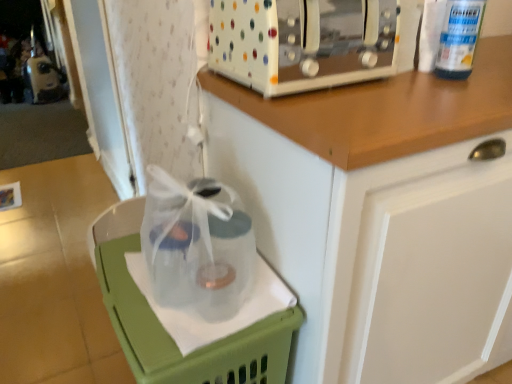
Locate an element on the screen. The width and height of the screenshot is (512, 384). white plastic bottle at upper right is located at coordinates (459, 38).

In order to face green plastic basket at lower left, should I rotate leftwards or rightwards?

A 8.299 degree turn to the left will do.

Identify the location of white plastic bottle at upper right. (459, 38).

Between white plastic bottle at upper right and green plastic basket at lower left, which one appears on the left side from the viewer's perspective?

green plastic basket at lower left.

Is white plastic bottle at upper right thinner than green plastic basket at lower left?

Correct, the width of white plastic bottle at upper right is less than that of green plastic basket at lower left.

What's the angular difference between white plastic bottle at upper right and green plastic basket at lower left's facing directions?

The angular difference between white plastic bottle at upper right and green plastic basket at lower left is 90.1 degrees.

Is white plastic bottle at upper right facing towards green plastic basket at lower left?

No, white plastic bottle at upper right is not oriented towards green plastic basket at lower left.

Is white plastic bottle at upper right outside of white polka dot toaster at upper center?

Yes, white plastic bottle at upper right is outside of white polka dot toaster at upper center.

Relative to white polka dot toaster at upper center, is white plastic bottle at upper right in front or behind?

Visually, white plastic bottle at upper right is located behind white polka dot toaster at upper center.

Considering the relative positions of white plastic bottle at upper right and white polka dot toaster at upper center in the image provided, is white plastic bottle at upper right to the left of white polka dot toaster at upper center from the viewer's perspective?

No, white plastic bottle at upper right is not to the left of white polka dot toaster at upper center.

Considering the sizes of objects green plastic basket at lower left and white plastic bottle at upper right in the image provided, who is shorter, green plastic basket at lower left or white plastic bottle at upper right?

With less height is white plastic bottle at upper right.

From a real-world perspective, is green plastic basket at lower left positioned under white plastic bottle at upper right based on gravity?

Yes, from a real-world perspective, green plastic basket at lower left is beneath white plastic bottle at upper right.

Is white polka dot toaster at upper center looking in the opposite direction of white glossy cabinet at upper center?

No, white polka dot toaster at upper center's orientation is not away from white glossy cabinet at upper center.

Between point (311, 23) and point (350, 311), which one is positioned in front?

Positioned in front is point (350, 311).

Which is behind, white polka dot toaster at upper center or white glossy cabinet at upper center?

white polka dot toaster at upper center is further away from the camera.

From the image's perspective, is white glossy cabinet at upper center positioned above or below white polka dot toaster at upper center?

Clearly, from the image's perspective, white glossy cabinet at upper center is below white polka dot toaster at upper center.

Does point (346, 173) come closer to viewer compared to point (286, 1)?

Yes.

Does white glossy cabinet at upper center have a greater width compared to white polka dot toaster at upper center?

Yes, white glossy cabinet at upper center is wider than white polka dot toaster at upper center.

Is white polka dot toaster at upper center taller than green plastic basket at lower left?

Incorrect, the height of white polka dot toaster at upper center is not larger of that of green plastic basket at lower left.

From a real-world perspective, who is located lower, white polka dot toaster at upper center or green plastic basket at lower left?

green plastic basket at lower left.

In the image, is white polka dot toaster at upper center on the left side or the right side of green plastic basket at lower left?

white polka dot toaster at upper center is to the right of green plastic basket at lower left.

In the image, is white polka dot toaster at upper center positioned in front of or behind green plastic basket at lower left?

In the image, white polka dot toaster at upper center appears behind green plastic basket at lower left.

Can you tell me how much white glossy cabinet at upper center and green plastic basket at lower left differ in facing direction?

The angle between the facing direction of white glossy cabinet at upper center and the facing direction of green plastic basket at lower left is 90.8 degrees.

Is white glossy cabinet at upper center next to green plastic basket at lower left and touching it?

No, white glossy cabinet at upper center is not making contact with green plastic basket at lower left.

Which is closer, [460,195] or [279,342]?

Point [460,195].

Is green plastic basket at lower left inside white glossy cabinet at upper center?

No, green plastic basket at lower left is located outside of white glossy cabinet at upper center.

Image resolution: width=512 pixels, height=384 pixels. In order to click on basket below the white plastic bottle at upper right (from a real-world perspective) in this screenshot , I will do `click(167, 332)`.

This screenshot has height=384, width=512. Find the location of `home appliance below the white plastic bottle at upper right (from the image's perspective)`. home appliance below the white plastic bottle at upper right (from the image's perspective) is located at coordinates (309, 42).

Based on their spatial positions, is white plastic bottle at upper right or white glossy cabinet at upper center closer to white polka dot toaster at upper center?

Based on the image, white plastic bottle at upper right appears to be nearer to white polka dot toaster at upper center.

Looking at this image, estimate the real-world distances between objects in this image. Which object is further from white plastic bottle at upper right, green plastic basket at lower left or white glossy cabinet at upper center?

green plastic basket at lower left is further to white plastic bottle at upper right.

Which object lies further to the anchor point white glossy cabinet at upper center, white polka dot toaster at upper center or white plastic bottle at upper right?

The object further to white glossy cabinet at upper center is white plastic bottle at upper right.

Based on their spatial positions, is white plastic bottle at upper right or green plastic basket at lower left closer to white polka dot toaster at upper center?

white plastic bottle at upper right.

Based on the photo, looking at the image, which one is located further to green plastic basket at lower left, white glossy cabinet at upper center or white polka dot toaster at upper center?

The object further to green plastic basket at lower left is white polka dot toaster at upper center.

Estimate the real-world distances between objects in this image. Which object is closer to white plastic bottle at upper right, white polka dot toaster at upper center or white glossy cabinet at upper center?

white polka dot toaster at upper center.

In the scene shown: Based on their spatial positions, is green plastic basket at lower left or white glossy cabinet at upper center further from white polka dot toaster at upper center?

Based on the image, green plastic basket at lower left appears to be further to white polka dot toaster at upper center.

Which object lies nearer to the anchor point white plastic bottle at upper right, white glossy cabinet at upper center or white polka dot toaster at upper center?

white polka dot toaster at upper center is closer to white plastic bottle at upper right.

Identify the location of cabinetry between white plastic bottle at upper right and green plastic basket at lower left vertically. (378, 213).

Locate an element on the screen. The height and width of the screenshot is (384, 512). home appliance between white plastic bottle at upper right and white glossy cabinet at upper center in the up-down direction is located at coordinates (309, 42).

Where is `home appliance between white plastic bottle at upper right and green plastic basket at lower left in the up-down direction`? This screenshot has width=512, height=384. home appliance between white plastic bottle at upper right and green plastic basket at lower left in the up-down direction is located at coordinates (309, 42).

Locate an element on the screen. The image size is (512, 384). cabinetry between white polka dot toaster at upper center and green plastic basket at lower left vertically is located at coordinates (378, 213).